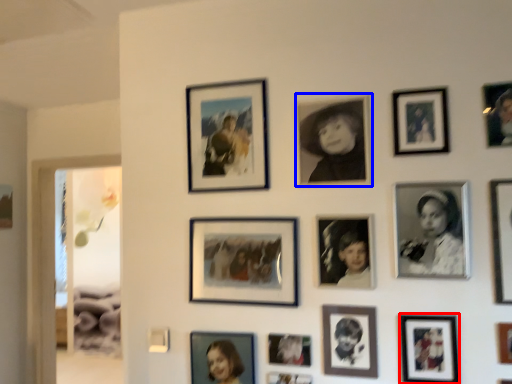
Question: Which object is closer to the camera taking this photo, picture frame (highlighted by a red box) or picture frame (highlighted by a blue box)?

Choices:
 (A) picture frame
 (B) picture frame

Answer: (A)